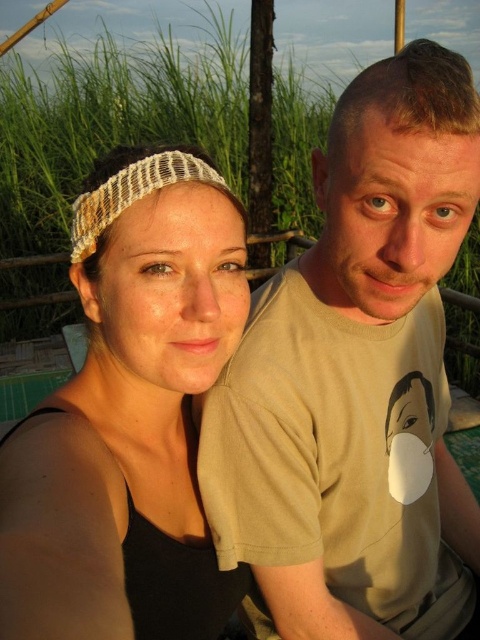
You are a photographer trying to capture the matte beige t shirt at right in the image. The camera you are using has a focus point at coordinate point [358,381]. Will the focus point be on the matte beige t shirt at right?

Yes, the focus point at coordinate point [358,381] is on the matte beige t shirt at right because the description states that the point lies on the matte beige t shirt at right.